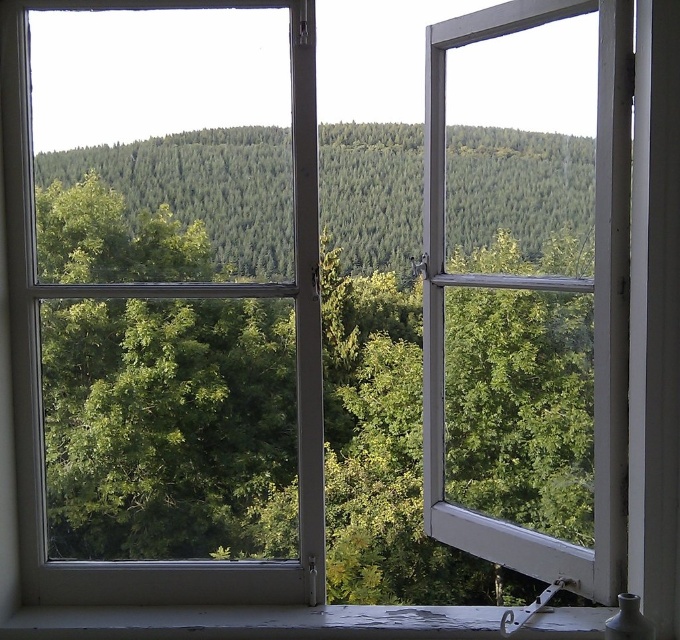
Consider the image. Can you confirm if green forested hill at center is positioned above white painted wood at lower center?

Yes.

Is point (454, 241) closer to viewer compared to point (575, 636)?

No, (454, 241) is further to viewer.

What do you see at coordinates (203, 188) in the screenshot? I see `green forested hill at center` at bounding box center [203, 188].

Locate an element on the screen. This screenshot has width=680, height=640. green forested hill at center is located at coordinates (203, 188).